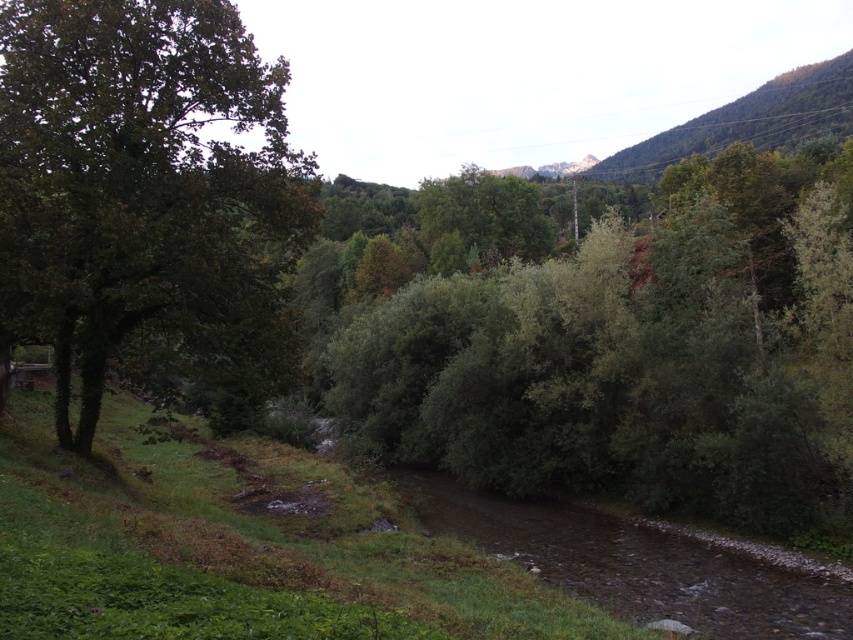
You are a hiker trying to navigate through the forest. You see a green leafy bush at center and a green leafy tree at left. Which one is located to the right of the other?

The green leafy bush at center is positioned on the right side of the green leafy tree at left.

You are a hiker standing at the edge of the grassy area in the foreground. You notice the green leafy bush at center and the green leafy tree at left. Which one is closer to you?

The green leafy bush at center is closer to you because the green leafy tree at left is positioned behind it.

Looking at this image, you are a hiker who wants to take a photo of the green leafy bush at center and the green leafy tree at left. Which object should you focus on first if you want to capture both in one frame without moving the camera?

You should focus on the green leafy tree at left first because it occupies more space than the green leafy bush at center, ensuring it is in focus while the bush may still be in the frame.